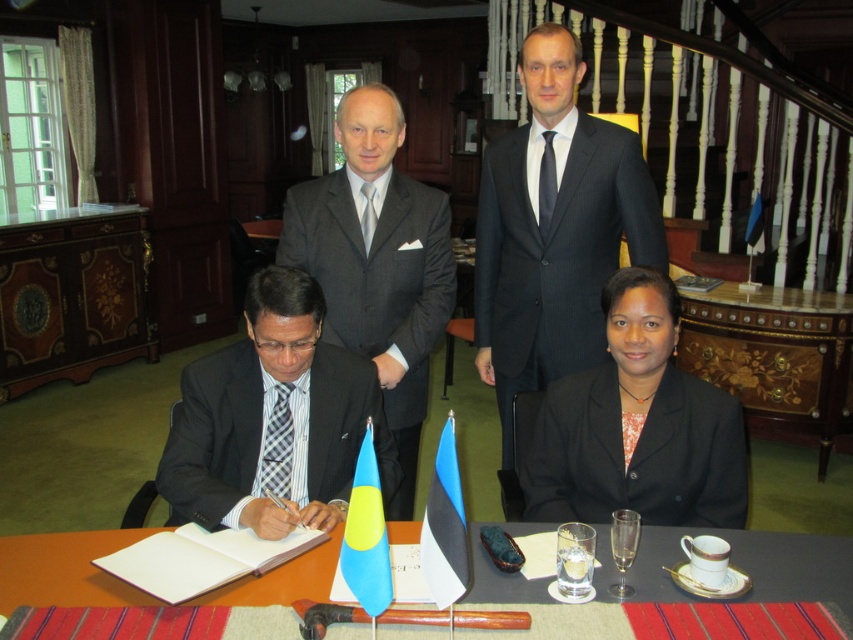
Based on the scene description, can you determine the spatial relationship between the dark gray suit at upper center and the marble top table at center?

The dark gray suit at upper center is to the left of the marble top table at center.

Consider the image. You are an event planner arranging a diplomatic meeting. You need to place a name tag for the attendee wearing the plaid fabric tie at lower left. Where should you place it relative to the blue fabric flag at lower center?

The blue fabric flag at lower center is larger in size than the plaid fabric tie at lower left. Since the flag is larger, the name tag for the plaid fabric tie at lower left should be placed closer to the attendee to ensure visibility next to the smaller item.

You are an observer at the meeting. You notice the blue fabric flag at lower center and the plaid fabric tie at lower left. Which object is positioned more to the right side of the table?

The blue fabric flag at lower center is positioned to the right of the plaid fabric tie at lower left, so the blue fabric flag at lower center is more to the right.